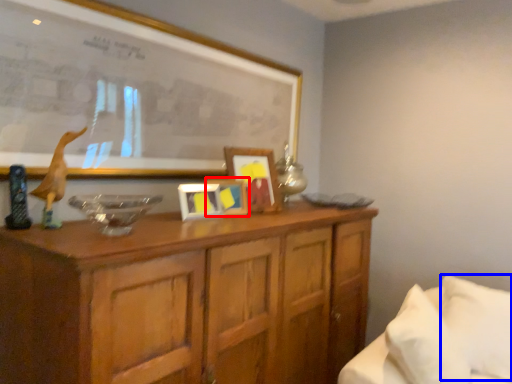
Question: Among these objects, which one is nearest to the camera, picture frame (highlighted by a red box) or pillow (highlighted by a blue box)?

Choices:
 (A) picture frame
 (B) pillow

Answer: (B)